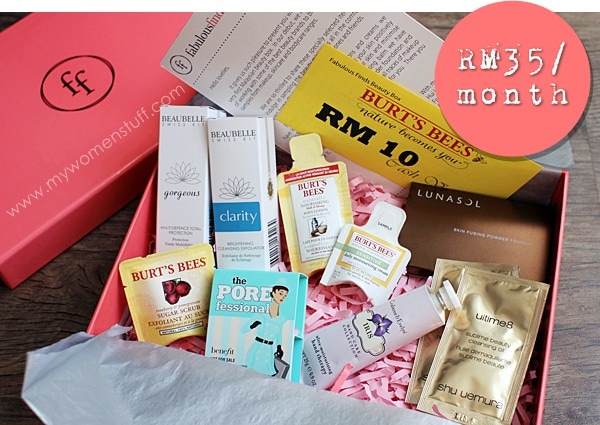
Where is `table`? table is located at coordinates (583, 349).